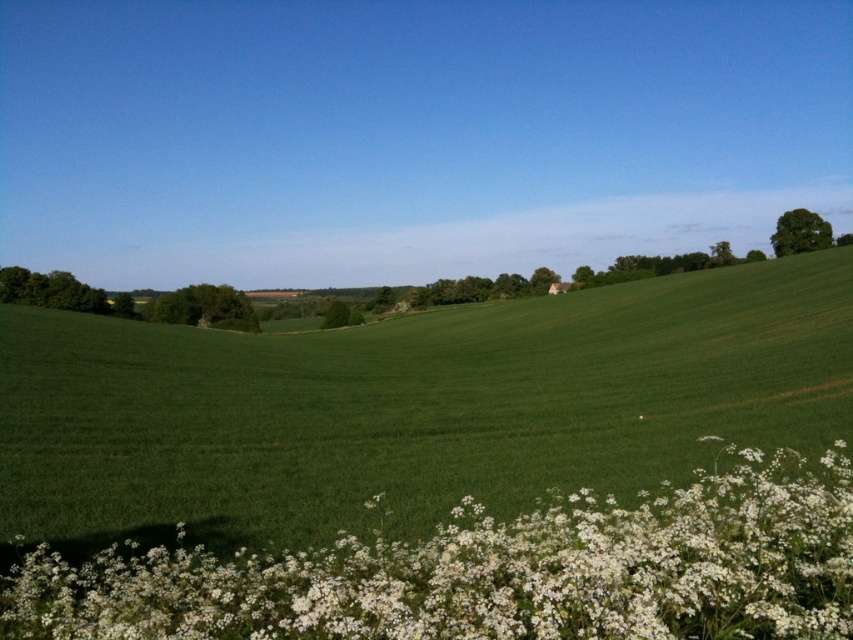
Question: Which object is closer to the camera taking this photo?

Choices:
 (A) white fluffy flowers at lower center
 (B) green grassy field at center

Answer: (A)

Question: Is green grassy field at center positioned at the back of white fluffy flowers at lower center?

Choices:
 (A) yes
 (B) no

Answer: (A)

Question: Which point is closer to the camera?

Choices:
 (A) (688, 532)
 (B) (701, 371)

Answer: (A)

Question: Is green grassy field at center to the left of white fluffy flowers at lower center from the viewer's perspective?

Choices:
 (A) no
 (B) yes

Answer: (A)

Question: Can you confirm if green grassy field at center is thinner than white fluffy flowers at lower center?

Choices:
 (A) yes
 (B) no

Answer: (B)

Question: Which point is closer to the camera taking this photo?

Choices:
 (A) click(521, 516)
 (B) click(167, 518)

Answer: (B)